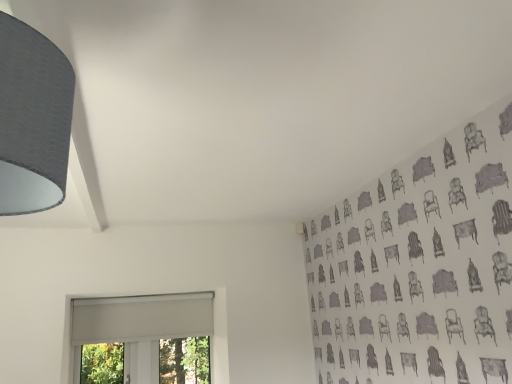
Question: Looking at their shapes, would you say matte gray lampshade at upper left is wider or thinner than white matte window at lower left?

Choices:
 (A) wide
 (B) thin

Answer: (A)

Question: Is point (52, 132) closer or farther from the camera than point (125, 299)?

Choices:
 (A) farther
 (B) closer

Answer: (B)

Question: Relative to white matte window at lower left, is matte gray lampshade at upper left in front or behind?

Choices:
 (A) behind
 (B) front

Answer: (B)

Question: In terms of size, does white matte window at lower left appear bigger or smaller than matte gray lampshade at upper left?

Choices:
 (A) big
 (B) small

Answer: (A)

Question: From the image's perspective, is white matte window at lower left located above or below matte gray lampshade at upper left?

Choices:
 (A) below
 (B) above

Answer: (A)

Question: Would you say white matte window at lower left is inside or outside matte gray lampshade at upper left?

Choices:
 (A) outside
 (B) inside

Answer: (A)

Question: Relative to matte gray lampshade at upper left, is white matte window at lower left in front or behind?

Choices:
 (A) front
 (B) behind

Answer: (B)